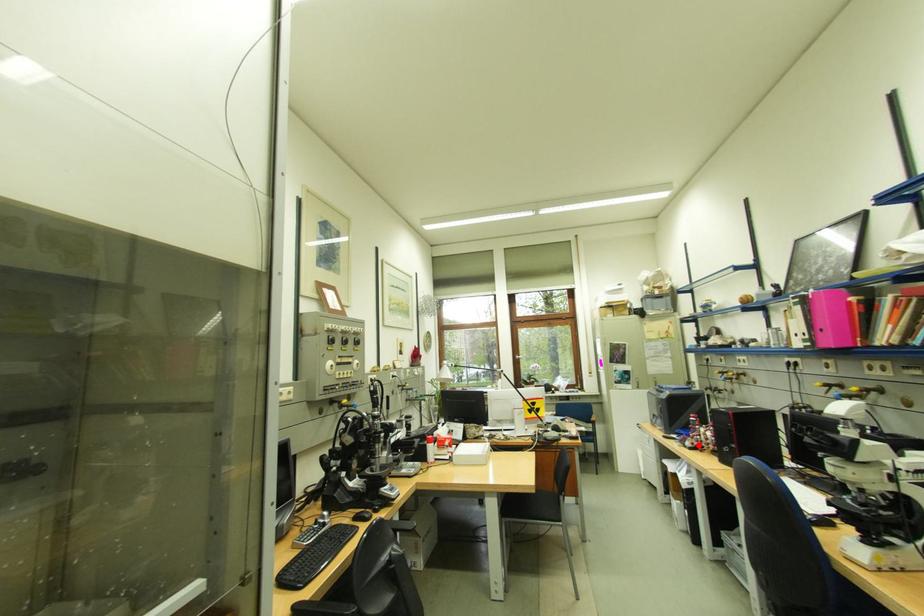
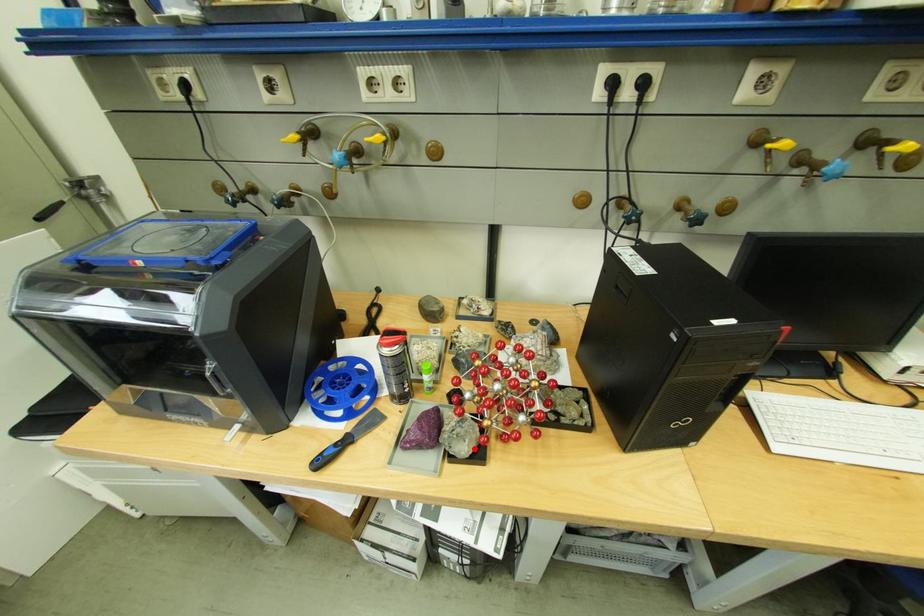
I am providing you with two images of the same scene from different viewpoints. A red point is marked on the first image and another point is marked on the second image. Is the marked point in image1 the same physical position as the marked point in image2?

Yes